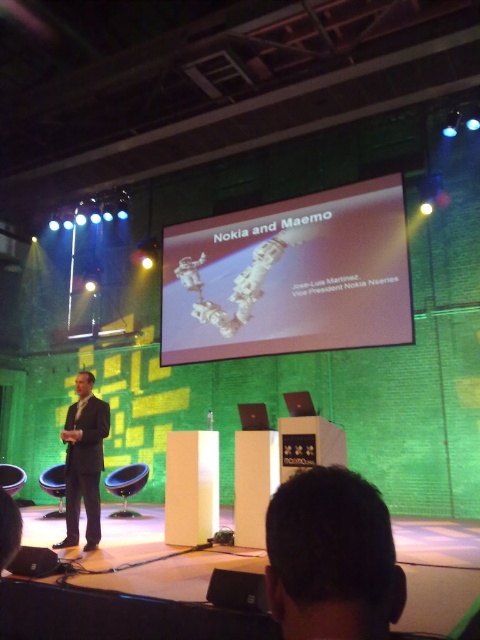
Is white glossy projector screen at upper center to the right of dark hair at upper center from the viewer's perspective?

Yes, white glossy projector screen at upper center is to the right of dark hair at upper center.

Between point (261, 269) and point (348, 500), which one is positioned behind?

Positioned behind is point (261, 269).

This screenshot has width=480, height=640. In order to click on white glossy projector screen at upper center in this screenshot , I will do `click(288, 276)`.

From the picture: Which is more to the left, dark hair at upper center or dark suit at center?

From the viewer's perspective, dark suit at center appears more on the left side.

Does point (309, 502) come closer to viewer compared to point (103, 464)?

That is True.

Describe the element at coordinates (332, 557) in the screenshot. I see `dark hair at upper center` at that location.

I want to click on dark hair at upper center, so [332, 557].

Is point (319, 349) more distant than point (83, 417)?

Yes, point (319, 349) is farther from viewer.

Does point (165, 326) lie in front of point (86, 483)?

No, (165, 326) is further to viewer.

At what (x,y) coordinates should I click in order to perform the action: click on white glossy projector screen at upper center. Please return your answer as a coordinate pair (x, y). This screenshot has height=640, width=480. Looking at the image, I should click on (288, 276).